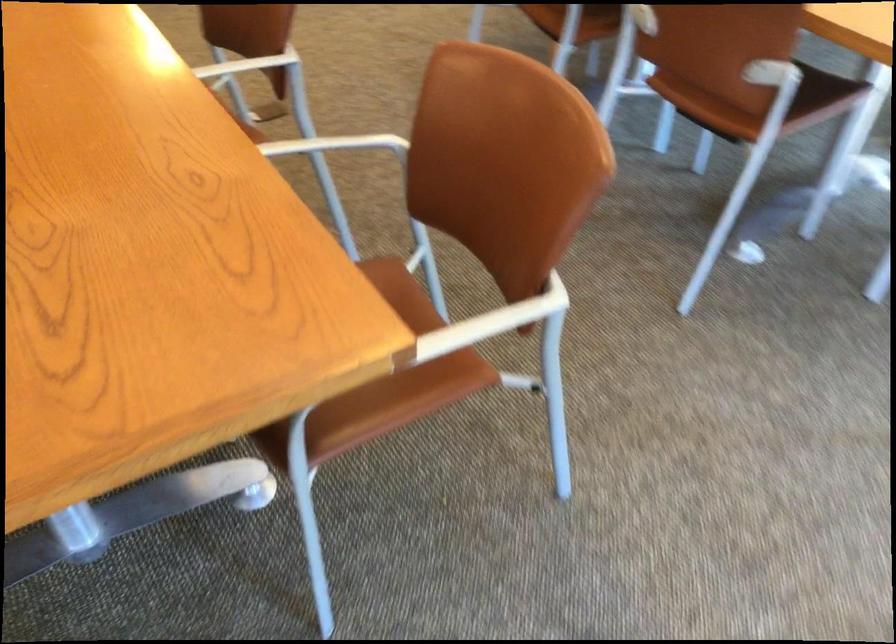
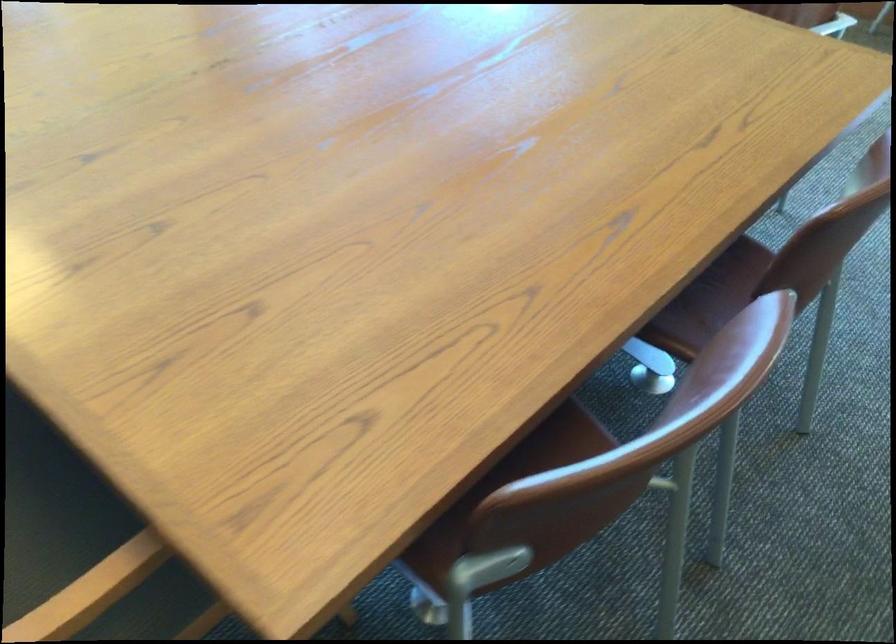
Find the pixel in the second image that matches (747,138) in the first image.

(711, 299)